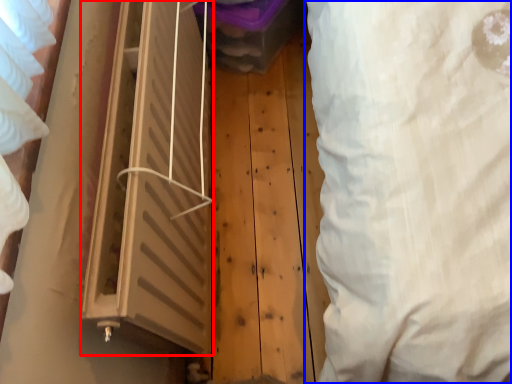
Question: Which point is further to the camera, window (highlighted by a red box) or curtain (highlighted by a blue box)?

Choices:
 (A) window
 (B) curtain

Answer: (A)